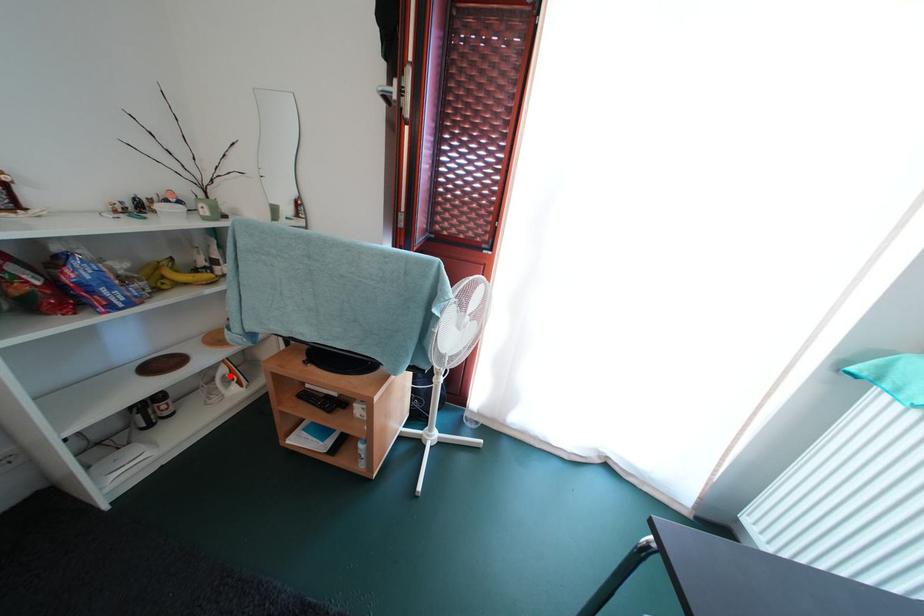
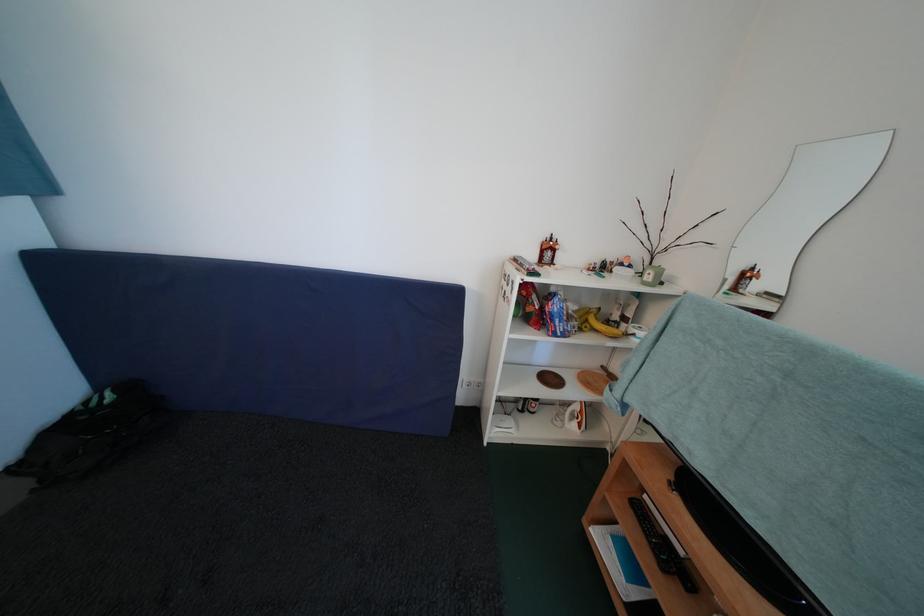
Question: I am providing you with two images of the same scene from different viewpoints. A red point is shown in image1. For the corresponding object point in image2, is it positioned nearer or farther from the camera?

Choices:
 (A) Nearer
 (B) Farther

Answer: (B)